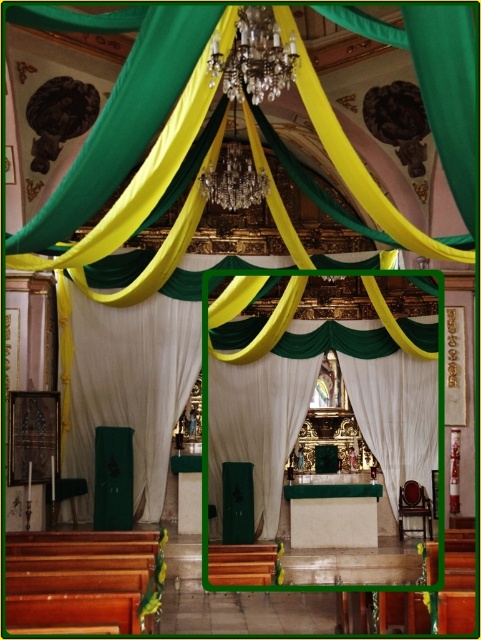
Is white sheer curtain at center below white satin curtain at center?

Yes.

Is white sheer curtain at center bigger than white satin curtain at center?

Yes.

Describe the element at coordinates (128, 387) in the screenshot. I see `white sheer curtain at center` at that location.

This screenshot has width=481, height=640. I want to click on white sheer curtain at center, so click(x=128, y=387).